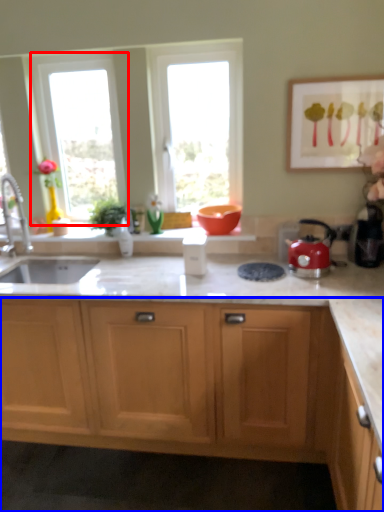
Question: Which object appears closest to the camera in this image, window (highlighted by a red box) or cabinetry (highlighted by a blue box)?

Choices:
 (A) window
 (B) cabinetry

Answer: (B)